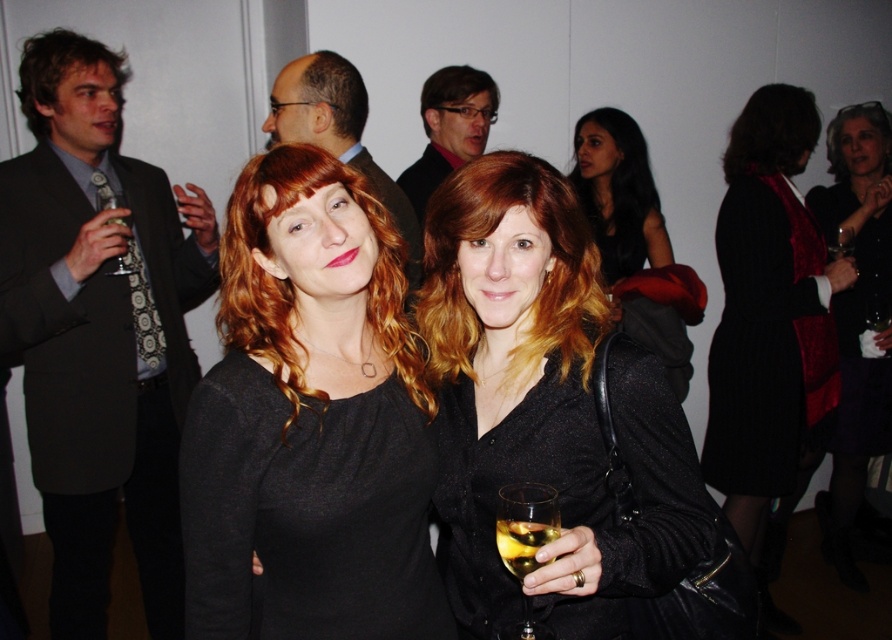
Measure the distance from dark gray suit at left to clear glass wine glass at left.

The distance of dark gray suit at left from clear glass wine glass at left is 11.75 inches.

Who is lower down, dark gray suit at left or clear glass wine glass at left?

dark gray suit at left is below.

Where is `dark gray suit at left`? dark gray suit at left is located at coordinates (98, 332).

Looking at this image, does black textured dress at center appear on the right side of velvet black dress at center?

Incorrect, black textured dress at center is not on the right side of velvet black dress at center.

Which is in front, point (585, 636) or point (857, 164)?

Positioned in front is point (585, 636).

The image size is (892, 640). Identify the location of black textured dress at center. (571, 492).

Does matte black shirt at center have a larger size compared to translucent glass wine at center?

Yes, matte black shirt at center is bigger than translucent glass wine at center.

Describe the element at coordinates (449, 129) in the screenshot. I see `matte black shirt at center` at that location.

You are a GUI agent. You are given a task and a screenshot of the screen. Output one action in this format:
    pyautogui.click(x=<x>, y=<y>)
    Task: Click on the matte black shirt at center
    The height and width of the screenshot is (640, 892).
    Given the screenshot: What is the action you would take?
    pyautogui.click(x=449, y=129)